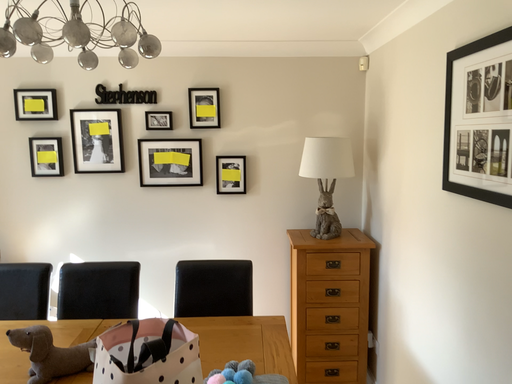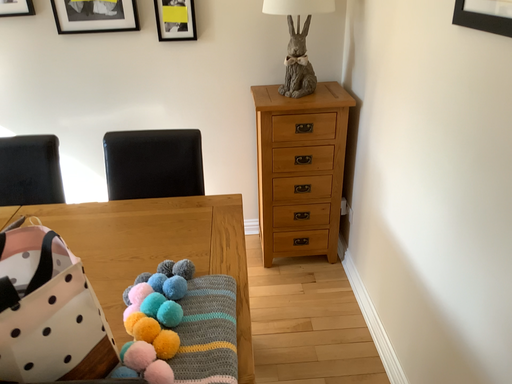
Question: How did the camera likely rotate when shooting the video?

Choices:
 (A) rotated downward
 (B) rotated upward

Answer: (A)